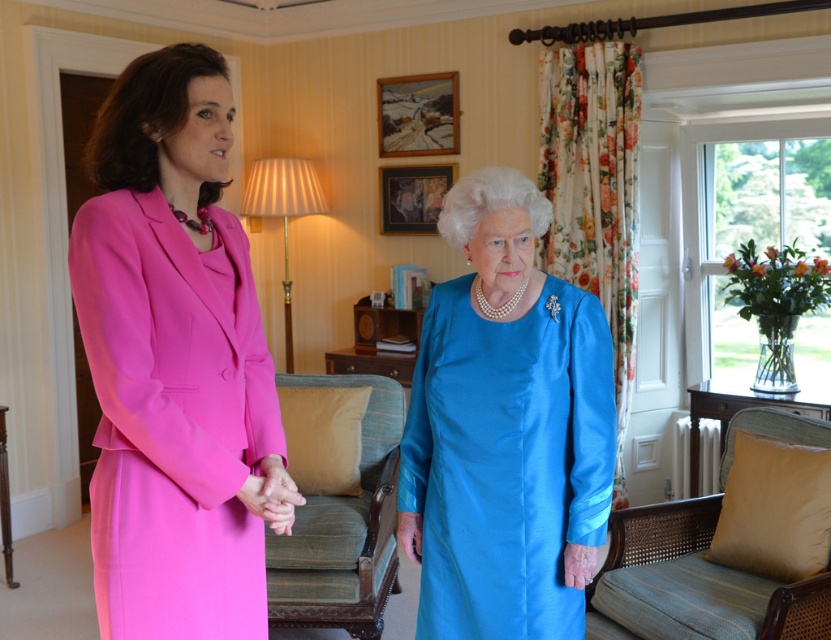
Looking at this image, is matte pink suit at left positioned at the back of matte pink dress at center?

No, matte pink suit at left is in front of matte pink dress at center.

Is point (242, 241) positioned in front of point (274, 499)?

No, it is not.

The width and height of the screenshot is (831, 640). Describe the element at coordinates (171, 358) in the screenshot. I see `matte pink suit at left` at that location.

This screenshot has width=831, height=640. Find the location of `matte pink suit at left`. matte pink suit at left is located at coordinates (171, 358).

This screenshot has height=640, width=831. What do you see at coordinates (342, 528) in the screenshot?
I see `green fabric armchair at center` at bounding box center [342, 528].

Locate an element on the screen. green fabric armchair at center is located at coordinates (342, 528).

Find the location of a particular element. green fabric armchair at center is located at coordinates (342, 528).

In the scene shown: Who is shorter, matte pink suit at left or satin blue dress at center?

Standing shorter between the two is satin blue dress at center.

Is point (111, 422) farther from viewer compared to point (510, 502)?

No, it is in front of (510, 502).

Is point (163, 554) positioned before point (525, 632)?

Yes, it is.

Locate an element on the screen. This screenshot has width=831, height=640. matte pink suit at left is located at coordinates (171, 358).